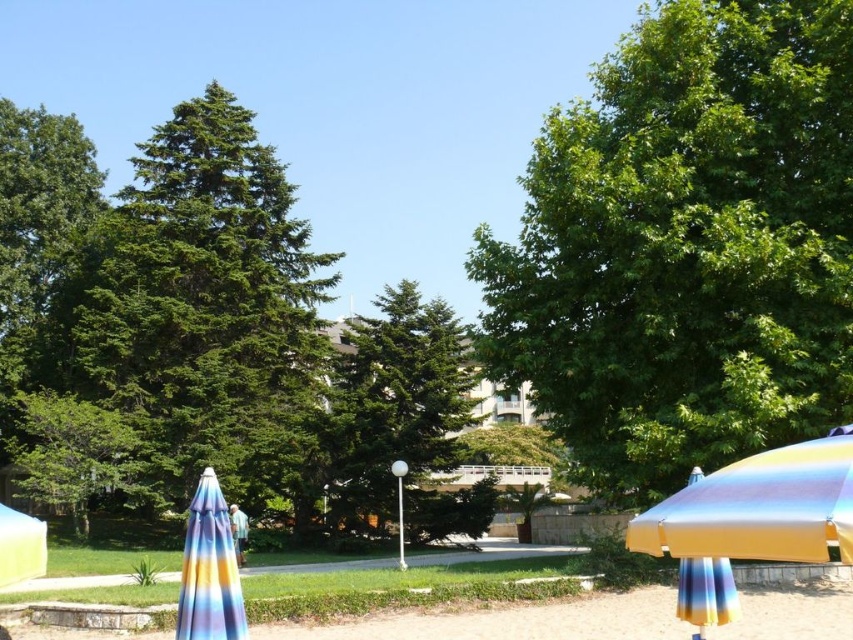
Question: Estimate the real-world distances between objects in this image. Which object is closer to the green matte tree at center?

Choices:
 (A) rainbow striped fabric umbrella at lower right
 (B) metallic rainbow umbrella at lower right

Answer: (A)

Question: Which object is closer to the camera taking this photo?

Choices:
 (A) green leafy tree at upper right
 (B) metallic rainbow umbrella at lower right
 (C) rainbow striped fabric umbrella at lower right
 (D) multicolored fabric umbrella at lower left

Answer: (B)

Question: Is green leafy tree at upper right positioned in front of metallic rainbow umbrella at lower right?

Choices:
 (A) yes
 (B) no

Answer: (B)

Question: In this image, where is multicolored fabric umbrella at lower left located relative to rainbow striped fabric umbrella at lower right?

Choices:
 (A) left
 (B) right

Answer: (A)

Question: Among these objects, which one is farthest from the camera?

Choices:
 (A) rainbow striped fabric umbrella at lower right
 (B) metallic rainbow umbrella at lower right
 (C) green leafy tree at upper right

Answer: (C)

Question: Does metallic rainbow umbrella at lower right appear over rainbow striped fabric umbrella at lower right?

Choices:
 (A) yes
 (B) no

Answer: (A)